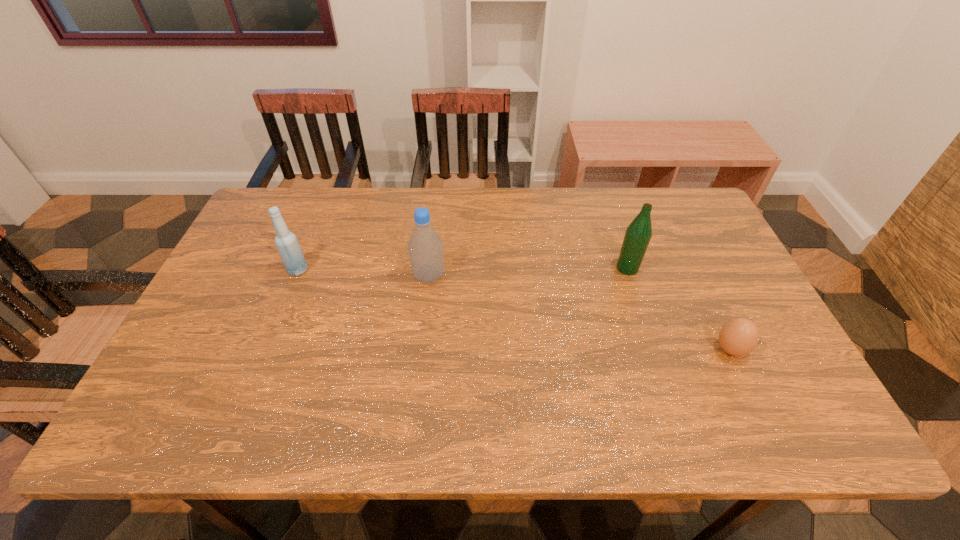
Where is `empty space that is in between the leftmost bottle and the rightmost bottle`? The image size is (960, 540). empty space that is in between the leftmost bottle and the rightmost bottle is located at coordinates (463, 269).

Identify the location of blank region between the boiled egg and the leftmost bottle. (515, 310).

Where is `free space between the leftmost object and the third object from left to right`? Image resolution: width=960 pixels, height=540 pixels. free space between the leftmost object and the third object from left to right is located at coordinates (463, 269).

At what (x,y) coordinates should I click in order to perform the action: click on blank region between the third object from left to right and the second object from left to right. Please return your answer as a coordinate pair (x, y). Looking at the image, I should click on (528, 272).

Find the location of a particular element. This screenshot has width=960, height=540. empty space between the second bottle from right to left and the leftmost object is located at coordinates (364, 273).

Find the location of a particular element. The image size is (960, 540). object that stands as the closest to the second bottle from left to right is located at coordinates (286, 242).

Image resolution: width=960 pixels, height=540 pixels. Find the location of `the second closest object to the rightmost bottle`. the second closest object to the rightmost bottle is located at coordinates (425, 247).

Identify the location of bottle that is the closest one to the leftmost bottle. Image resolution: width=960 pixels, height=540 pixels. (425, 247).

At what (x,y) coordinates should I click in order to perform the action: click on the second closest bottle to the second bottle from left to right. Please return your answer as a coordinate pair (x, y). Image resolution: width=960 pixels, height=540 pixels. Looking at the image, I should click on (638, 234).

Identify the location of free point that satisfies the following two spatial constraints: 1. on the front side of the leftmost object; 2. on the right side of the second bottle from left to right. This screenshot has width=960, height=540. (296, 276).